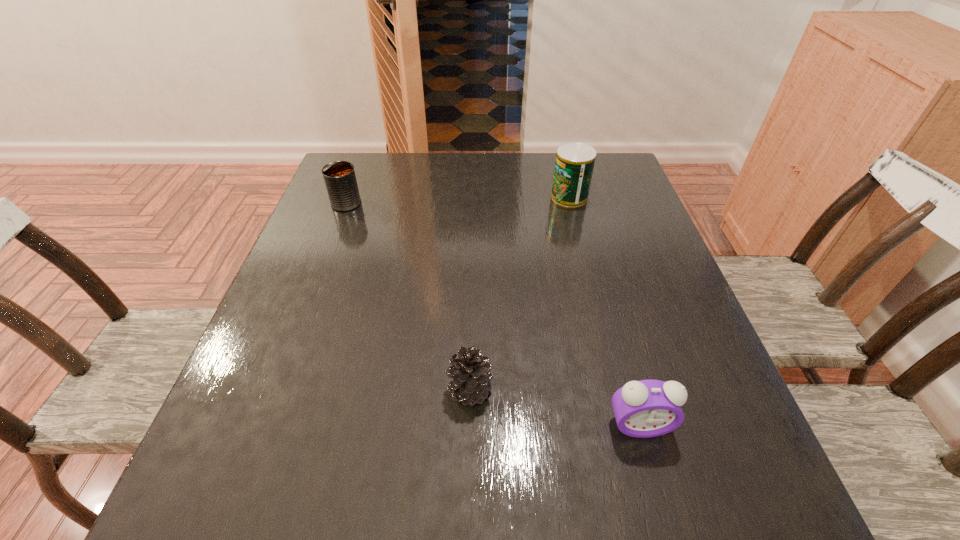
Select which object is the third closest to the alarm clock. Please provide its 2D coordinates. Your answer should be formatted as a tuple, i.e. [(x, y)], where the tuple contains the x and y coordinates of a point satisfying the conditions above.

[(339, 176)]

What are the coordinates of `blank space that satisfies the following two spatial constraints: 1. on the front side of the left can; 2. on the right side of the pinecone` in the screenshot? It's located at (276, 390).